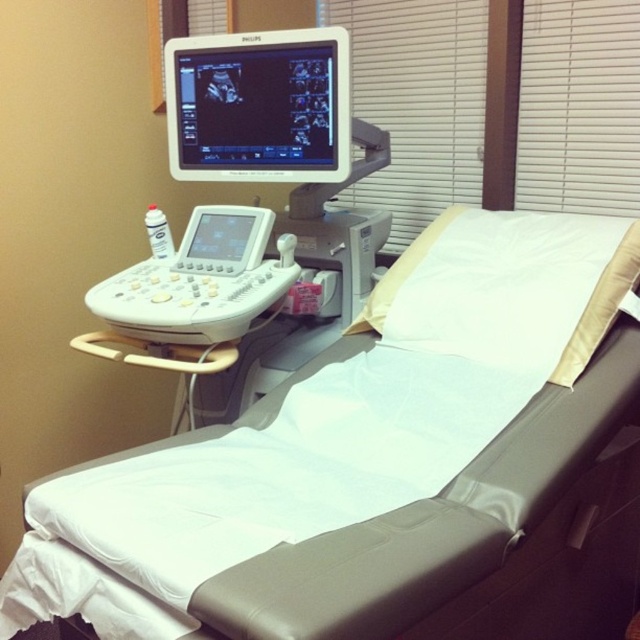
Question: Is white vinyl bed at center thinner than white glossy monitor at upper center?

Choices:
 (A) no
 (B) yes

Answer: (A)

Question: Is white vinyl bed at center below white plastic ultrasound machine at left?

Choices:
 (A) yes
 (B) no

Answer: (A)

Question: Which is nearer to the white plastic blinds at upper center?

Choices:
 (A) white plastic ultrasound machine at left
 (B) white glossy monitor at upper center

Answer: (B)

Question: Where is white vinyl bed at center located in relation to white plastic ultrasound machine at left in the image?

Choices:
 (A) left
 (B) right

Answer: (B)

Question: Which of these objects is positioned closest to the white plastic blinds at upper center?

Choices:
 (A) white vinyl bed at center
 (B) white glossy monitor at upper center

Answer: (B)

Question: Which of the following is the closest to the observer?

Choices:
 (A) white vinyl bed at center
 (B) white plastic blinds at upper center
 (C) white glossy monitor at upper center

Answer: (A)